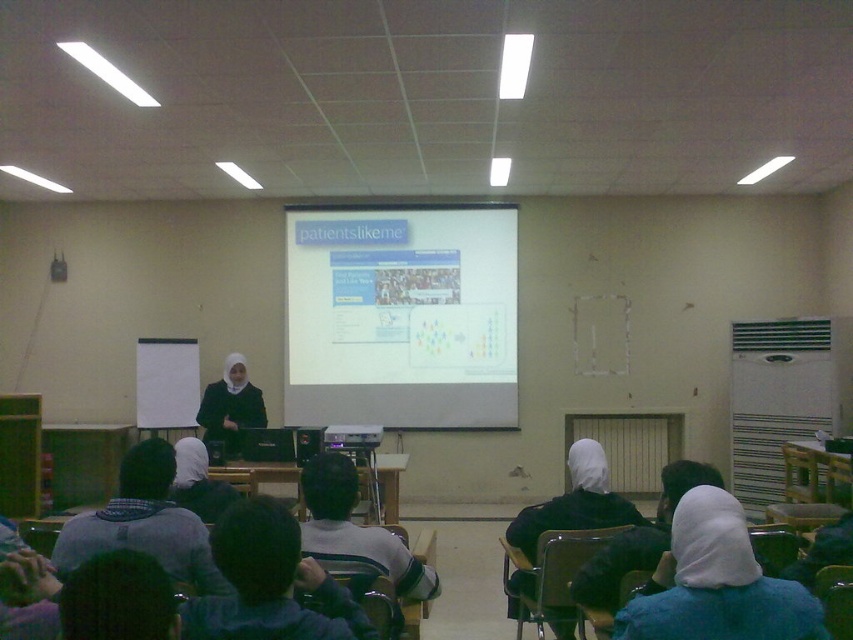
You are a student sitting in the classroom and want to take a photo of the presenter. Which object, the gray knitted sweater at lower left or the matte black hijab at center, is positioned more to the left side of the presenter?

The matte black hijab at center is positioned more to the left side of the presenter because the gray knitted sweater at lower left is to the right of matte black hijab at center.